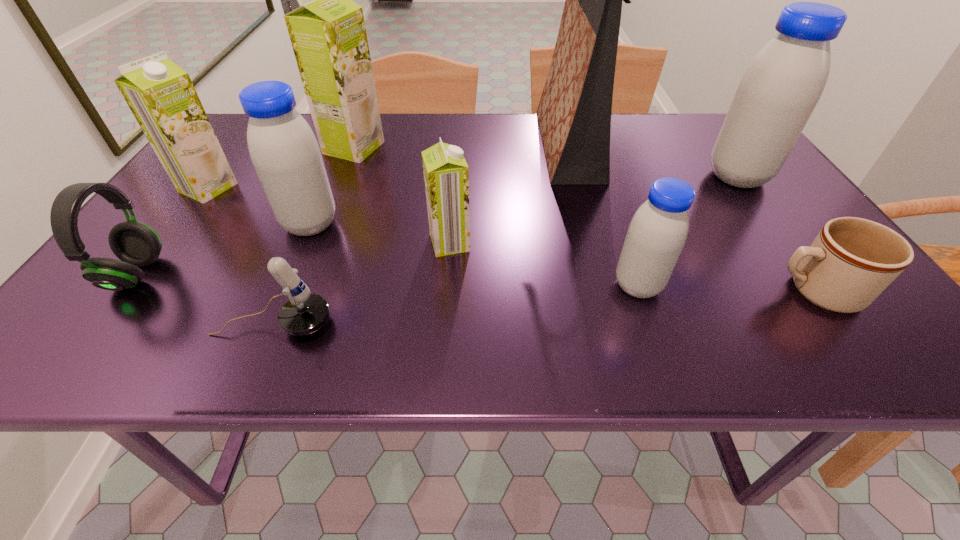
This screenshot has height=540, width=960. I want to click on vacant space located on the front-facing side of the tallest object, so click(x=444, y=145).

Find the location of a particular element. free location located on the right of the second green soya milk from left to right is located at coordinates (508, 147).

You are a GUI agent. You are given a task and a screenshot of the screen. Output one action in this format:
    pyautogui.click(x=<x>, y=<y>)
    Task: Click on the vacant space located on the left of the rightmost soya milk
    
    Given the screenshot: What is the action you would take?
    pyautogui.click(x=617, y=177)

In order to click on free location located 0.230m on the front of the leftmost soya milk in this screenshot , I will do `click(143, 275)`.

The width and height of the screenshot is (960, 540). I want to click on vacant space situated 0.120m on the back of the second biggest blue soya milk, so click(x=330, y=178).

Find the location of a particular element. The height and width of the screenshot is (540, 960). free space located on the right of the nearest green soya milk is located at coordinates (514, 243).

Where is `vacant space located 0.230m on the right of the second soya milk from right to left`? vacant space located 0.230m on the right of the second soya milk from right to left is located at coordinates (782, 286).

Locate an element on the screen. Image resolution: width=960 pixels, height=540 pixels. vacant space located on the ear cups of the headset is located at coordinates click(288, 274).

Locate an element on the screen. This screenshot has height=540, width=960. vacant space located on the right of the ninth tallest object is located at coordinates [508, 323].

This screenshot has height=540, width=960. Find the location of `vacant region located on the side of the brown mug with the handle`. vacant region located on the side of the brown mug with the handle is located at coordinates (743, 292).